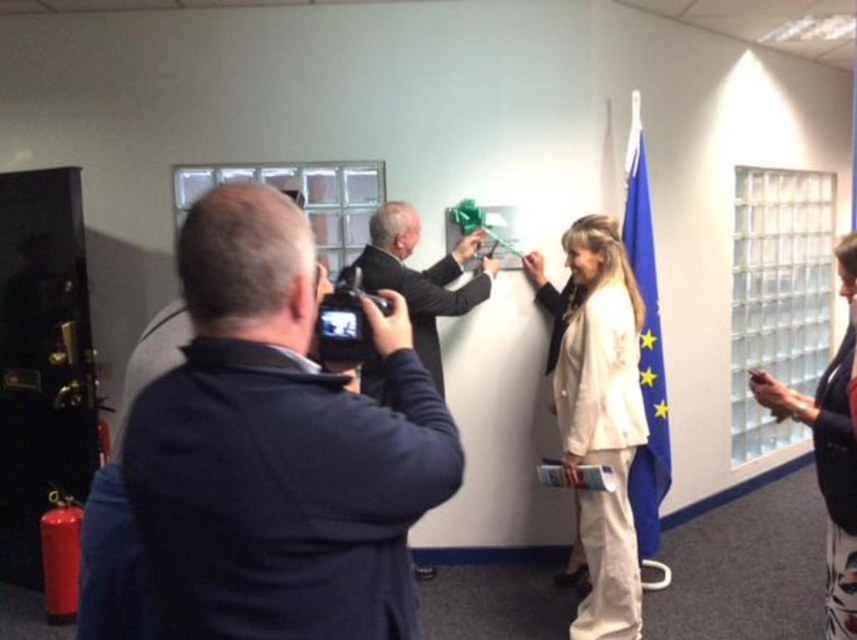
Question: Which of the following is the closest to the observer?

Choices:
 (A) dark suit jacket at center
 (B) blue fabric flag at right
 (C) floral pants at right

Answer: (C)

Question: Does dark suit jacket at center appear over blue fabric flag at right?

Choices:
 (A) yes
 (B) no

Answer: (A)

Question: Is dark blue sweater at center further to the viewer compared to dark suit jacket at center?

Choices:
 (A) yes
 (B) no

Answer: (B)

Question: Which object appears closest to the camera in this image?

Choices:
 (A) blue fabric flag at right
 (B) light beige fabric jacket at center

Answer: (B)

Question: Which of these objects is positioned farthest from the dark suit jacket at center?

Choices:
 (A) dark blue sweater at center
 (B) light beige fabric jacket at center
 (C) floral pants at right

Answer: (A)

Question: Where is dark suit jacket at center located in relation to blue fabric flag at right in the image?

Choices:
 (A) above
 (B) below

Answer: (A)